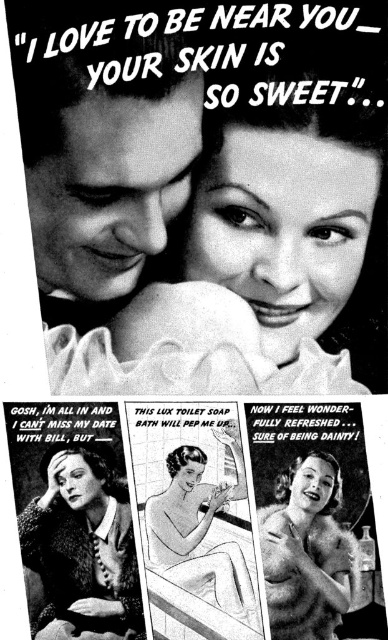
Question: Estimate the real-world distances between objects in this image. Which object is closer to the knitted sweater at lower left?

Choices:
 (A) fuzzy fur coat at lower right
 (B) smooth porcelain soap at center
 (C) smooth skin at center

Answer: (B)

Question: Which point is closer to the camera?

Choices:
 (A) fuzzy fur coat at lower right
 (B) knitted sweater at lower left
 (C) smooth skin at upper center

Answer: (C)

Question: Among these points, which one is farthest from the camera?

Choices:
 (A) (204, 506)
 (B) (51, 225)

Answer: (A)

Question: Is smooth skin at upper center positioned before fuzzy fur coat at lower right?

Choices:
 (A) yes
 (B) no

Answer: (A)

Question: In this image, where is knitted sweater at lower left located relative to fuzzy fur coat at lower right?

Choices:
 (A) right
 (B) left

Answer: (B)

Question: Is smooth skin at upper center wider than knitted sweater at lower left?

Choices:
 (A) yes
 (B) no

Answer: (A)